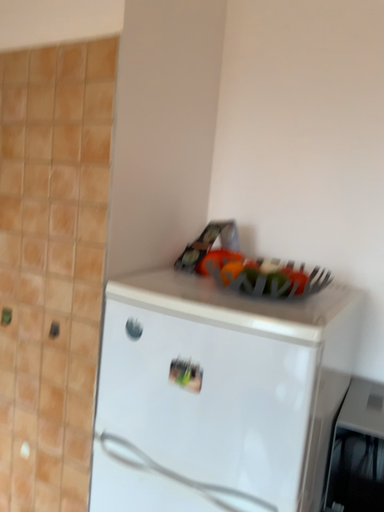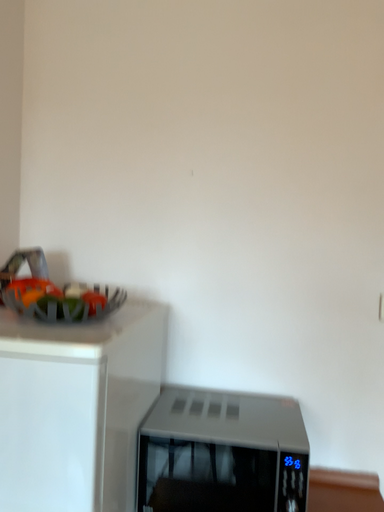
Question: How did the camera likely rotate when shooting the video?

Choices:
 (A) rotated right
 (B) rotated left

Answer: (A)